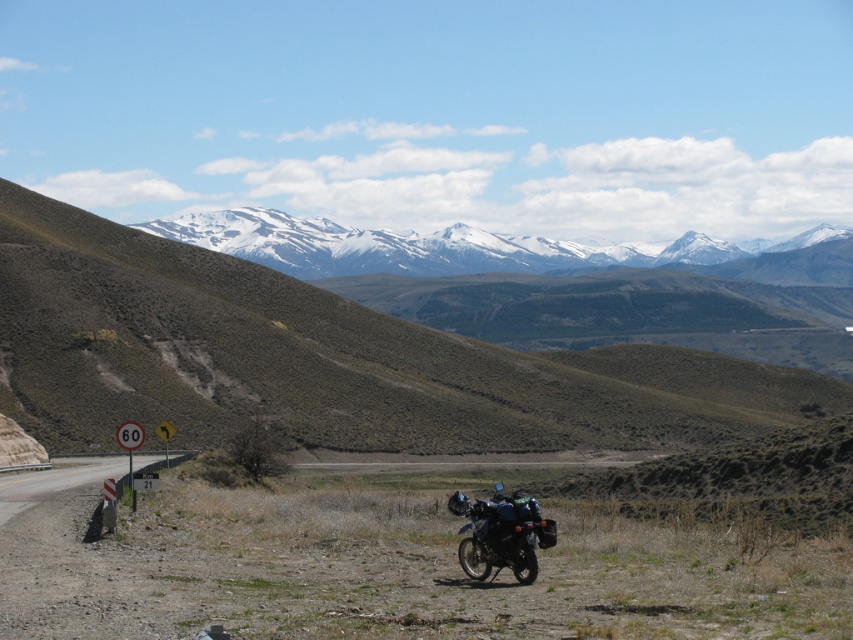
Who is positioned more to the left, metallic dark green motorcycle at center or metallic road sign at lower left?

metallic road sign at lower left is more to the left.

Is metallic dark green motorcycle at center closer to camera compared to metallic road sign at lower left?

Yes, metallic dark green motorcycle at center is closer to the viewer.

Image resolution: width=853 pixels, height=640 pixels. Find the location of `metallic dark green motorcycle at center`. metallic dark green motorcycle at center is located at coordinates (502, 534).

Does brown/dry grassy hillside at upper center have a smaller size compared to metallic road sign at lower left?

No.

From the picture: Does brown/dry grassy hillside at upper center have a lesser width compared to metallic road sign at lower left?

No, brown/dry grassy hillside at upper center is not thinner than metallic road sign at lower left.

Is point (245, 336) closer to camera compared to point (107, 458)?

No, it is behind (107, 458).

Identify the location of brown/dry grassy hillside at upper center. Image resolution: width=853 pixels, height=640 pixels. click(318, 358).

Is brown/dry grassy hillside at upper center wider than brushed metal signpost at left?

Indeed, brown/dry grassy hillside at upper center has a greater width compared to brushed metal signpost at left.

Between brown/dry grassy hillside at upper center and brushed metal signpost at left, which one is positioned lower?

brushed metal signpost at left

What do you see at coordinates (318, 358) in the screenshot? I see `brown/dry grassy hillside at upper center` at bounding box center [318, 358].

At what (x,y) coordinates should I click in order to perform the action: click on brown/dry grassy hillside at upper center. Please return your answer as a coordinate pair (x, y). This screenshot has width=853, height=640. Looking at the image, I should click on [318, 358].